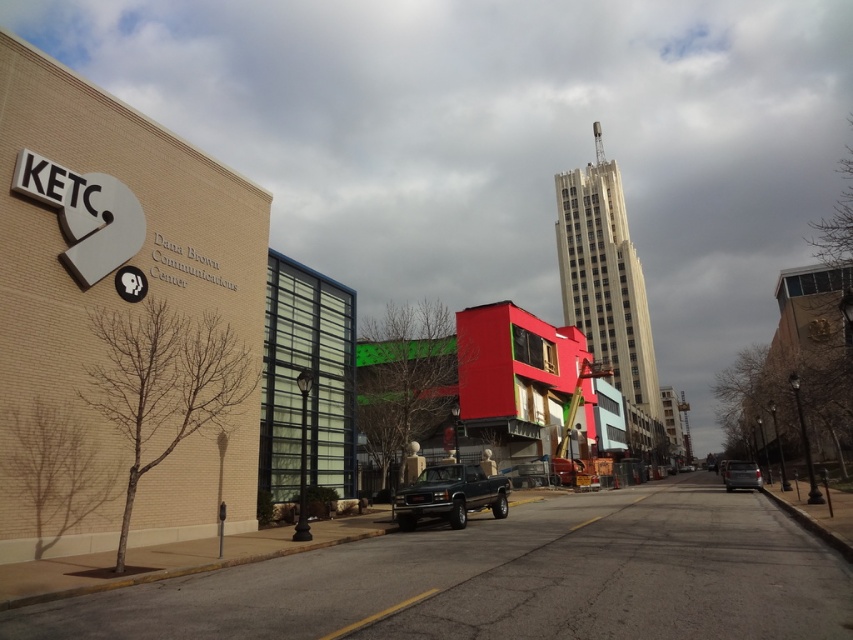
Question: Does matte black truck at center appear on the right side of metallic gray van at center?

Choices:
 (A) no
 (B) yes

Answer: (A)

Question: Does matte black truck at center lie in front of metallic gray van at center?

Choices:
 (A) yes
 (B) no

Answer: (A)

Question: Does matte black truck at center have a lesser width compared to metallic gray van at center?

Choices:
 (A) yes
 (B) no

Answer: (B)

Question: Which of the following is the farthest from the observer?

Choices:
 (A) metallic gray van at center
 (B) matte black truck at center

Answer: (A)